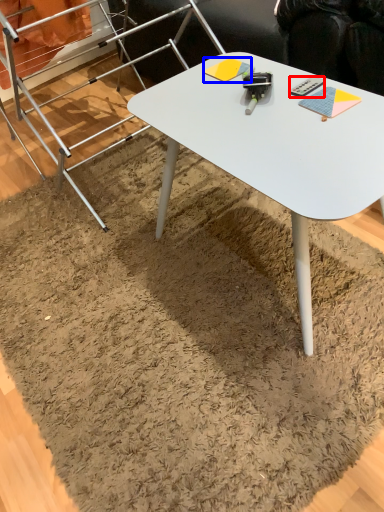
Question: Which point is closer to the camera, remote control (highlighted by a red box) or notepad (highlighted by a blue box)?

Choices:
 (A) remote control
 (B) notepad

Answer: (A)